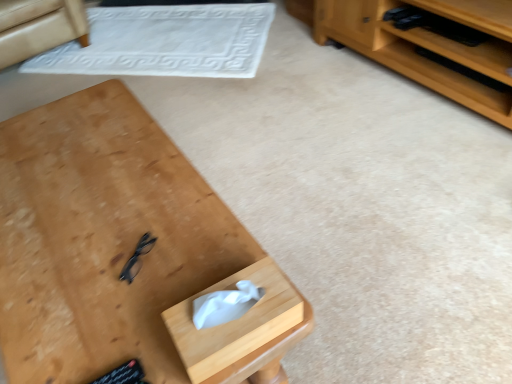
Question: Is wooden desk at center taller than white textured mat at upper center?

Choices:
 (A) yes
 (B) no

Answer: (A)

Question: Would you say wooden desk at center is a long distance from white textured mat at upper center?

Choices:
 (A) no
 (B) yes

Answer: (B)

Question: Is wooden desk at center surrounding white textured mat at upper center?

Choices:
 (A) yes
 (B) no

Answer: (B)

Question: From a real-world perspective, is wooden desk at center positioned over white textured mat at upper center based on gravity?

Choices:
 (A) yes
 (B) no

Answer: (A)

Question: Considering the relative positions of wooden desk at center and white textured mat at upper center in the image provided, is wooden desk at center to the left of white textured mat at upper center from the viewer's perspective?

Choices:
 (A) no
 (B) yes

Answer: (A)

Question: Is wooden desk at center thinner than white textured mat at upper center?

Choices:
 (A) yes
 (B) no

Answer: (A)

Question: Is white textured mat at upper center not within wooden tissue box at lower center?

Choices:
 (A) no
 (B) yes

Answer: (B)

Question: Does white textured mat at upper center have a greater height compared to wooden tissue box at lower center?

Choices:
 (A) yes
 (B) no

Answer: (B)

Question: Is white textured mat at upper center further to camera compared to wooden tissue box at lower center?

Choices:
 (A) yes
 (B) no

Answer: (A)

Question: Is there a large distance between white textured mat at upper center and wooden tissue box at lower center?

Choices:
 (A) yes
 (B) no

Answer: (A)

Question: Is white textured mat at upper center bigger than wooden tissue box at lower center?

Choices:
 (A) yes
 (B) no

Answer: (A)

Question: From the image's perspective, is white textured mat at upper center located above wooden tissue box at lower center?

Choices:
 (A) no
 (B) yes

Answer: (B)

Question: Considering the relative sizes of wooden desk at center and wooden tissue box at lower center in the image provided, is wooden desk at center wider than wooden tissue box at lower center?

Choices:
 (A) yes
 (B) no

Answer: (A)